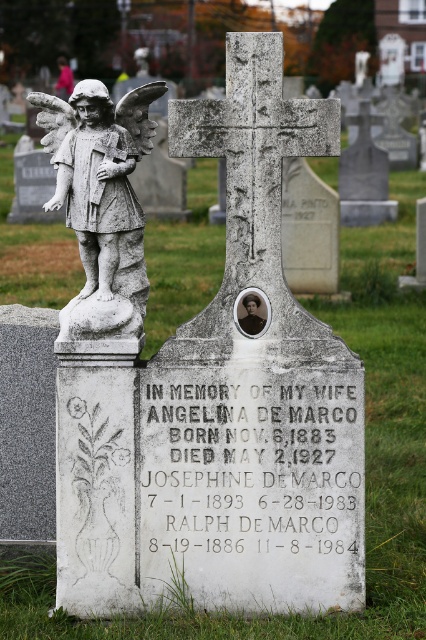
You are standing in front of the gravestone and want to place a bouquet of flowers at the base of the white marble statue at upper left. Based on the gravestone inscription, which family member is the statue likely commemorating?

The white marble statue at upper left is likely commemorating Josephine De Marco, as she lived the longest until 1983, outliving both Angelina and Ralph De Marco.

You are visiting the cemetery and want to take a photo of both the white marble statue at upper left and the white stone angel at left. Which object should you focus on first to ensure both are in the frame?

You should focus on the white marble statue at upper left first because it is much taller than the white stone angel at left, so positioning the camera to include its full height will naturally include the smaller angel in the frame.

You are a visitor at the cemetery and want to take a photo of both the white marble statue at upper left and the white stone angel at left. Can you fit both in your camera frame if the maximum width your camera can capture is 3.5 feet?

The white marble statue at upper left and white stone angel at left are 3.52 feet apart from each other. Since 3.52 feet is slightly wider than the camera frame of 3.5 feet, you cannot fit both in the photo.